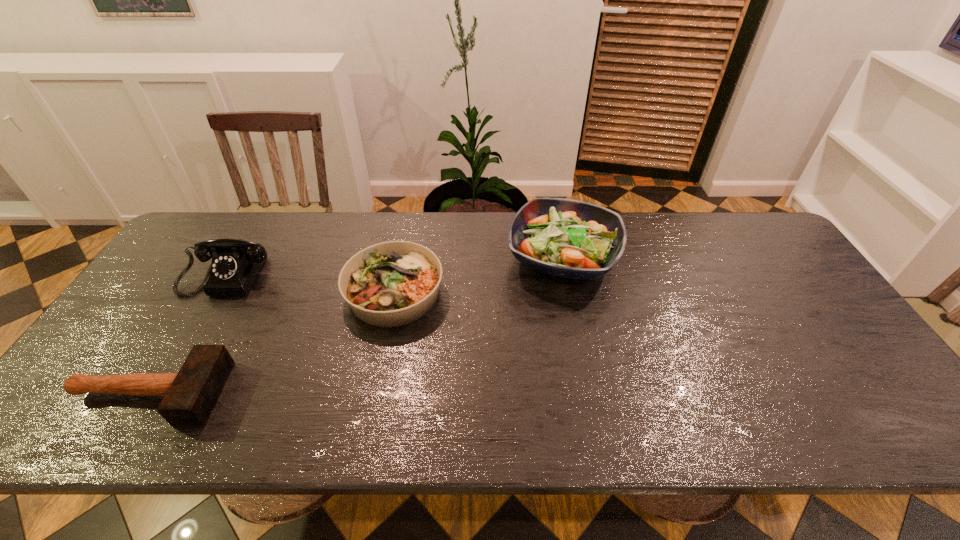
Find the location of a particular element. the taller salad plate is located at coordinates (568, 238).

Locate an element on the screen. The height and width of the screenshot is (540, 960). the rightmost object is located at coordinates (568, 238).

Identify the location of telephone. The width and height of the screenshot is (960, 540). (236, 263).

At what (x,y) coordinates should I click in order to perform the action: click on the shorter salad plate. Please return your answer as a coordinate pair (x, y). Image resolution: width=960 pixels, height=540 pixels. Looking at the image, I should click on (389, 284).

This screenshot has width=960, height=540. Find the location of `the left salad plate`. the left salad plate is located at coordinates (389, 284).

Find the location of a particular element. The image size is (960, 540). the nearest object is located at coordinates (189, 396).

Locate an element on the screen. mallet is located at coordinates (189, 396).

Find the location of a particular element. vacant space located 0.310m on the front of the taller salad plate is located at coordinates (591, 396).

Where is `vacant space located 0.310m on the dial of the telephone`? Image resolution: width=960 pixels, height=540 pixels. vacant space located 0.310m on the dial of the telephone is located at coordinates (157, 396).

Locate an element on the screen. The image size is (960, 540). vacant region located 0.060m on the back of the shorter salad plate is located at coordinates (403, 247).